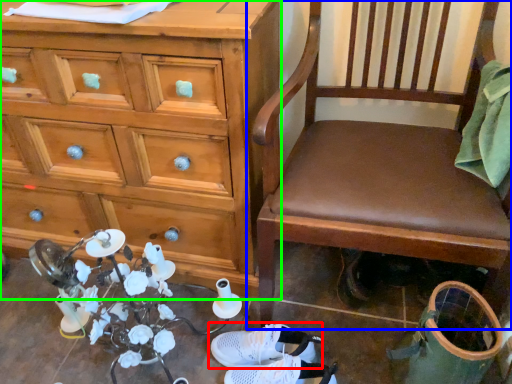
Question: Which is nearer to the footwear (highlighted by a red box)? chair (highlighted by a blue box) or chest of drawers (highlighted by a green box).

Choices:
 (A) chair
 (B) chest of drawers

Answer: (A)